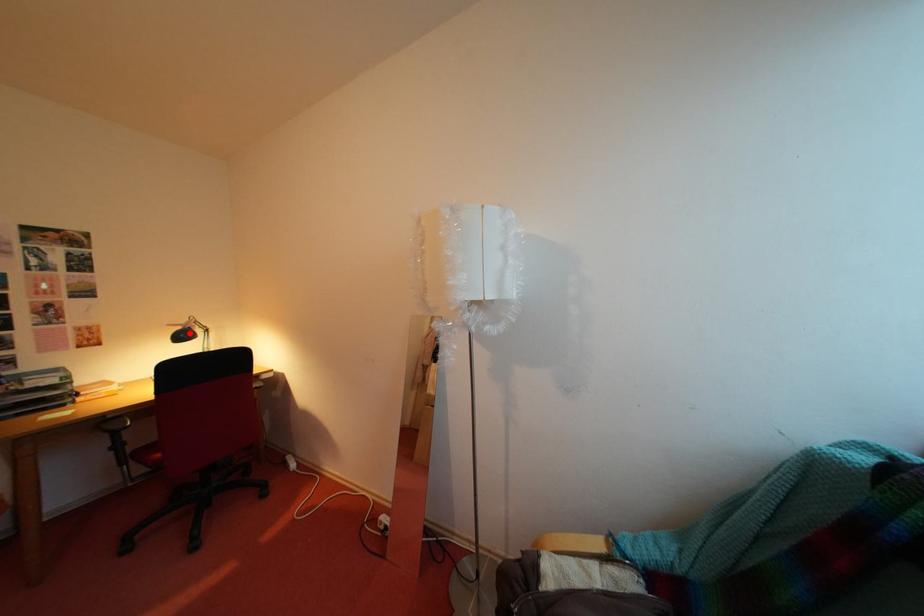
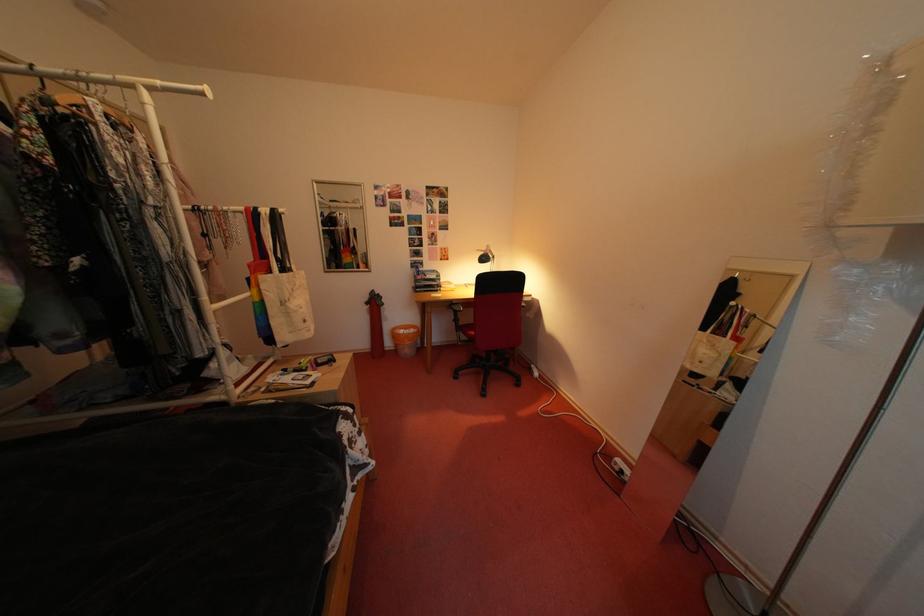
Locate, in the second image, the point that corresponds to the highlighted location in the first image.

(492, 257)